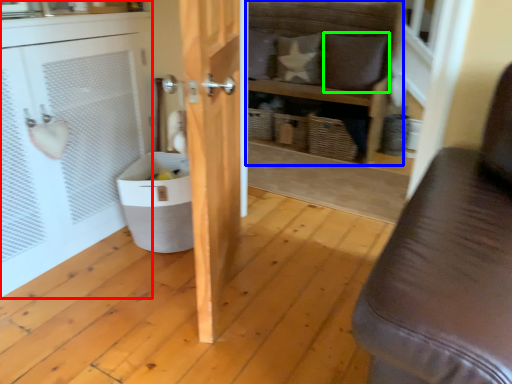
Question: Which is farther away from cabinetry (highlighted by a red box)? shelf (highlighted by a blue box) or pillow (highlighted by a green box)?

Choices:
 (A) shelf
 (B) pillow

Answer: (B)